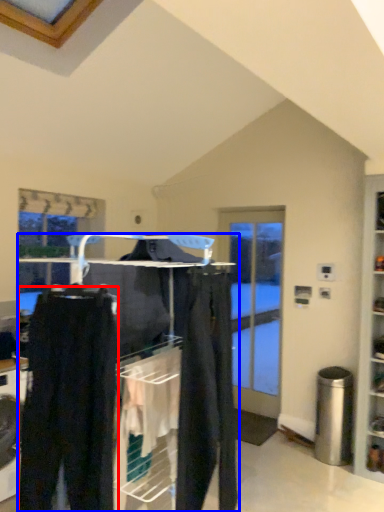
Question: Which of the following is the closest to the observer, trousers (highlighted by a red box) or closet (highlighted by a blue box)?

Choices:
 (A) trousers
 (B) closet

Answer: (A)